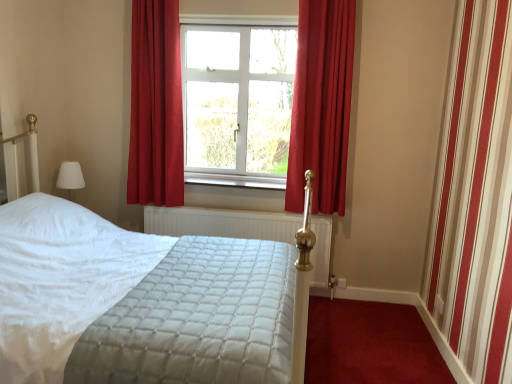
Question: Is white textured radiator at center a part of white quilted mattress at center?

Choices:
 (A) no
 (B) yes

Answer: (A)

Question: Does white quilted mattress at center appear on the left side of white textured radiator at center?

Choices:
 (A) no
 (B) yes

Answer: (B)

Question: Considering the relative sizes of white quilted mattress at center and white textured radiator at center in the image provided, is white quilted mattress at center wider than white textured radiator at center?

Choices:
 (A) yes
 (B) no

Answer: (A)

Question: Can you confirm if white quilted mattress at center is thinner than white textured radiator at center?

Choices:
 (A) no
 (B) yes

Answer: (A)

Question: From the image's perspective, is white quilted mattress at center located beneath white textured radiator at center?

Choices:
 (A) yes
 (B) no

Answer: (B)

Question: From their relative heights in the image, would you say white painted wood at center is taller or shorter than velvet red curtain at center, the first curtain viewed from the right?

Choices:
 (A) short
 (B) tall

Answer: (A)

Question: From the image's perspective, is white painted wood at center above or below velvet red curtain at center, the first curtain viewed from the right?

Choices:
 (A) below
 (B) above

Answer: (A)

Question: Is white painted wood at center bigger or smaller than velvet red curtain at center, the second curtain in the left-to-right sequence?

Choices:
 (A) small
 (B) big

Answer: (A)

Question: Considering the relative positions of white painted wood at center and velvet red curtain at center, the second curtain in the left-to-right sequence, in the image provided, is white painted wood at center to the left or to the right of velvet red curtain at center, the second curtain in the left-to-right sequence,?

Choices:
 (A) right
 (B) left

Answer: (B)

Question: From a real-world perspective, is white plastic window at center positioned above or below white textured radiator at center?

Choices:
 (A) above
 (B) below

Answer: (A)

Question: Would you say white plastic window at center is to the left or to the right of white textured radiator at center in the picture?

Choices:
 (A) left
 (B) right

Answer: (A)

Question: Considering the positions of white plastic window at center and white textured radiator at center in the image, is white plastic window at center taller or shorter than white textured radiator at center?

Choices:
 (A) tall
 (B) short

Answer: (A)

Question: Considering the positions of point (194, 135) and point (180, 223), is point (194, 135) closer or farther from the camera than point (180, 223)?

Choices:
 (A) closer
 (B) farther

Answer: (B)

Question: Is point (267, 246) positioned closer to the camera than point (219, 59)?

Choices:
 (A) closer
 (B) farther

Answer: (A)

Question: Do you think white quilted mattress at center is within white plastic window at center, or outside of it?

Choices:
 (A) outside
 (B) inside

Answer: (A)